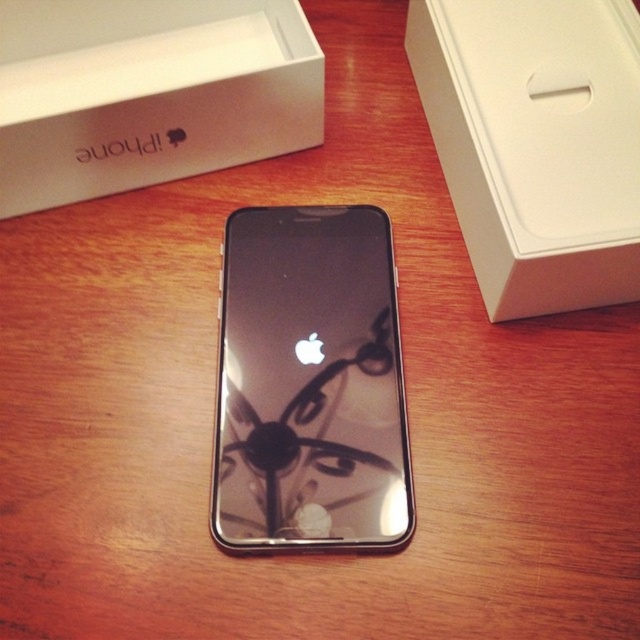
Based on the photo, you are organizing items on a desk and need to stack the sleek black phone at center and the white matte box at upper right. Which item should you place at the bottom to ensure stability?

The white matte box at upper right should be placed at the bottom since it is taller than the sleek black phone at center, providing a stable base for stacking.

You are organizing items on a desk and see the white matte box at upper right and the white matte iPhone box at upper left. Which box is positioned more to the east?

The white matte box at upper right is positioned more to the east because it is to the right of the white matte iPhone box at upper left.

You are designing a layout for a product catalog and need to place an image of a smartphone exactly at the center of the page. The page has a coordinate system where the bottom left corner is at point 0,0 and the top right corner is at point 1,1. You have the image of the sleek black phone at center from the scene. Where should you position the phone in the coordinate system to ensure it is centered?

To center the sleek black phone at center on the page, position it at point [320,320] in the coordinate system.